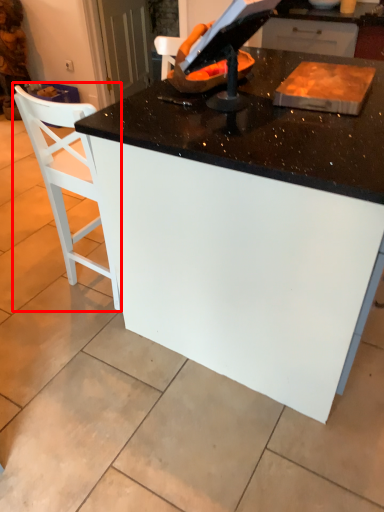
Question: From the image's perspective, where is chair (annotated by the red box) located relative to table?

Choices:
 (A) below
 (B) above

Answer: (B)